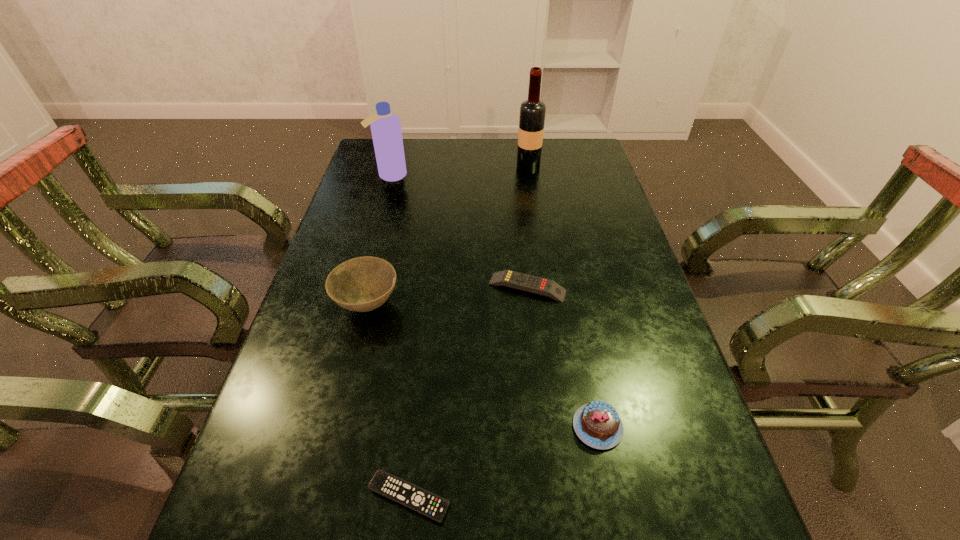
The image size is (960, 540). In order to click on wine bottle in this screenshot , I will do coord(532,111).

The height and width of the screenshot is (540, 960). I want to click on shampoo, so click(385, 126).

This screenshot has width=960, height=540. Identify the location of bowl. (362, 284).

In order to click on chocolate cake in this screenshot , I will do `click(597, 424)`.

Locate an element on the screen. The width and height of the screenshot is (960, 540). the fourth tallest object is located at coordinates point(597,424).

You are a GUI agent. You are given a task and a screenshot of the screen. Output one action in this format:
    pyautogui.click(x=<x>, y=<y>)
    Task: Click on the farther remote control
    
    Given the screenshot: What is the action you would take?
    pyautogui.click(x=521, y=281)

Find the location of a particular element. The width and height of the screenshot is (960, 540). the right remote control is located at coordinates (521, 281).

At what (x,y) coordinates should I click in order to perform the action: click on the nearer remote control. Please return your answer as a coordinate pair (x, y). Looking at the image, I should click on (392, 487).

Locate an element on the screen. The height and width of the screenshot is (540, 960). the shorter remote control is located at coordinates (392, 487).

Image resolution: width=960 pixels, height=540 pixels. What are the coordinates of `free space located on the front of the wine bottle` in the screenshot? It's located at (536, 220).